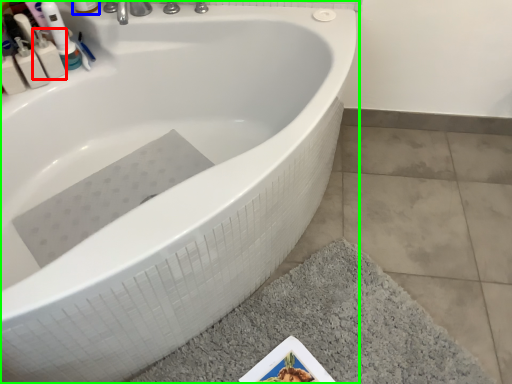
Question: Estimate the real-world distances between objects in this image. Which object is farther from mouthwash (highlighted by a red box), mouthwash (highlighted by a blue box) or bathtub (highlighted by a green box)?

Choices:
 (A) mouthwash
 (B) bathtub

Answer: (B)